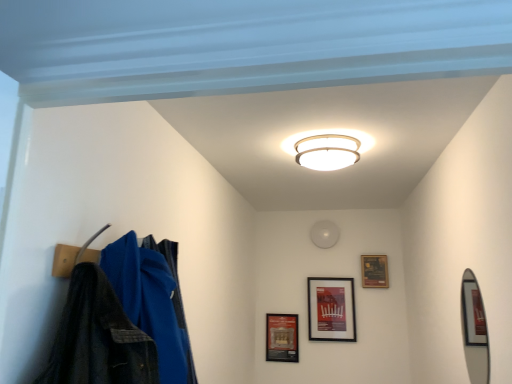
Question: Is white glossy ceiling light at center closer to camera compared to matte brown picture frame at upper right, the 1th picture frame viewed from the right?

Choices:
 (A) no
 (B) yes

Answer: (B)

Question: Considering the relative sizes of white glossy ceiling light at center and matte brown picture frame at upper right, which ranks as the third picture frame in left-to-right order, in the image provided, is white glossy ceiling light at center wider than matte brown picture frame at upper right, which ranks as the third picture frame in left-to-right order,?

Choices:
 (A) yes
 (B) no

Answer: (A)

Question: Considering the relative positions of white glossy ceiling light at center and matte brown picture frame at upper right, which ranks as the third picture frame in left-to-right order, in the image provided, is white glossy ceiling light at center behind matte brown picture frame at upper right, which ranks as the third picture frame in left-to-right order,?

Choices:
 (A) no
 (B) yes

Answer: (A)

Question: Considering the relative sizes of white glossy ceiling light at center and matte brown picture frame at upper right, the 1th picture frame viewed from the right, in the image provided, is white glossy ceiling light at center shorter than matte brown picture frame at upper right, the 1th picture frame viewed from the right,?

Choices:
 (A) no
 (B) yes

Answer: (B)

Question: Is white glossy ceiling light at center at the right side of matte brown picture frame at upper right, the 1th picture frame viewed from the right?

Choices:
 (A) yes
 (B) no

Answer: (B)

Question: Looking at the image, does black matte picture frame at upper center, positioned as the second picture frame in right-to-left order, seem bigger or smaller compared to matte brown picture frame at upper right, which ranks as the third picture frame in left-to-right order?

Choices:
 (A) small
 (B) big

Answer: (B)

Question: From the image's perspective, is black matte picture frame at upper center, positioned as the second picture frame in right-to-left order, located above or below matte brown picture frame at upper right, which ranks as the third picture frame in left-to-right order?

Choices:
 (A) below
 (B) above

Answer: (A)

Question: From a real-world perspective, is black matte picture frame at upper center, positioned as the second picture frame in right-to-left order, physically located above or below matte brown picture frame at upper right, which ranks as the third picture frame in left-to-right order?

Choices:
 (A) below
 (B) above

Answer: (A)

Question: Considering the positions of black matte picture frame at upper center, positioned as the second picture frame in right-to-left order, and matte brown picture frame at upper right, which ranks as the third picture frame in left-to-right order, in the image, is black matte picture frame at upper center, positioned as the second picture frame in right-to-left order, taller or shorter than matte brown picture frame at upper right, which ranks as the third picture frame in left-to-right order,?

Choices:
 (A) tall
 (B) short

Answer: (A)

Question: Is matte brown picture frame at upper right, the 1th picture frame viewed from the right, bigger or smaller than white glossy ceiling light at center?

Choices:
 (A) big
 (B) small

Answer: (B)

Question: Would you say matte brown picture frame at upper right, the 1th picture frame viewed from the right, is to the left or to the right of white glossy ceiling light at center in the picture?

Choices:
 (A) right
 (B) left

Answer: (A)

Question: Would you say matte brown picture frame at upper right, which ranks as the third picture frame in left-to-right order, is inside or outside white glossy ceiling light at center?

Choices:
 (A) outside
 (B) inside

Answer: (A)

Question: In terms of width, does matte brown picture frame at upper right, the 1th picture frame viewed from the right, look wider or thinner when compared to white glossy ceiling light at center?

Choices:
 (A) thin
 (B) wide

Answer: (A)

Question: Visually, is black matte picture frame at upper center, positioned as the second picture frame in right-to-left order, positioned to the left or to the right of silver metallic mirror at right?

Choices:
 (A) left
 (B) right

Answer: (A)

Question: In terms of height, does black matte picture frame at upper center, positioned as the second picture frame in right-to-left order, look taller or shorter compared to silver metallic mirror at right?

Choices:
 (A) tall
 (B) short

Answer: (B)